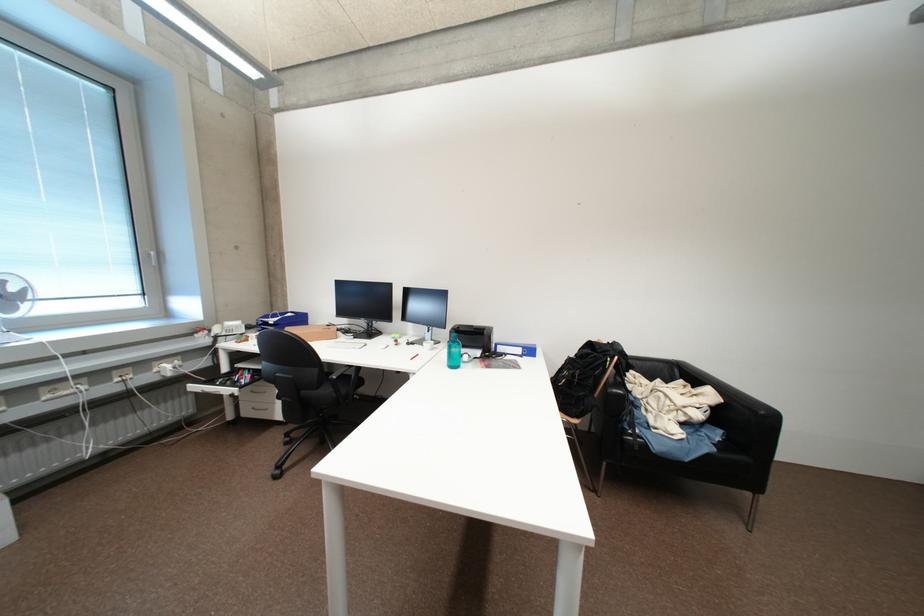
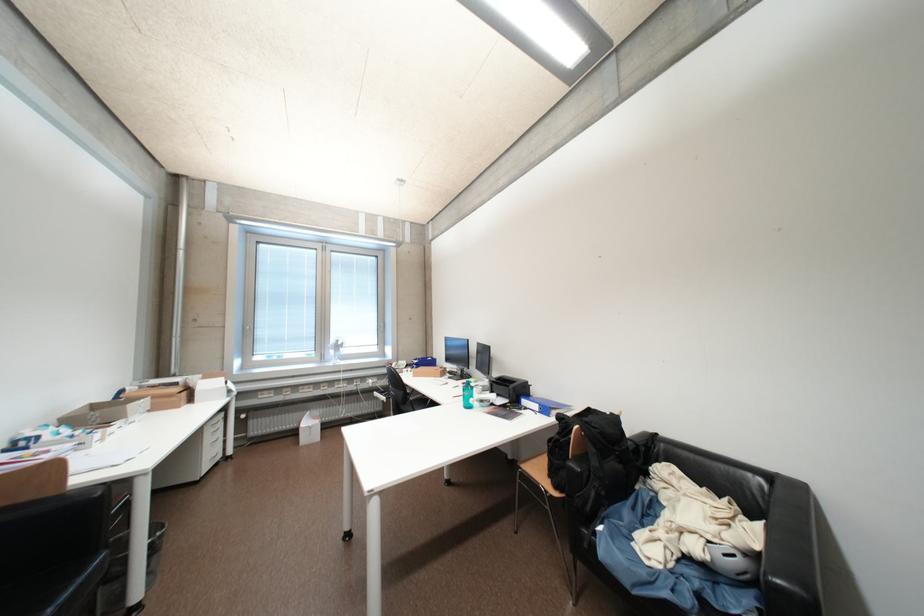
The point at (514, 357) is marked in the first image. Where is the corresponding point in the second image?

(533, 411)